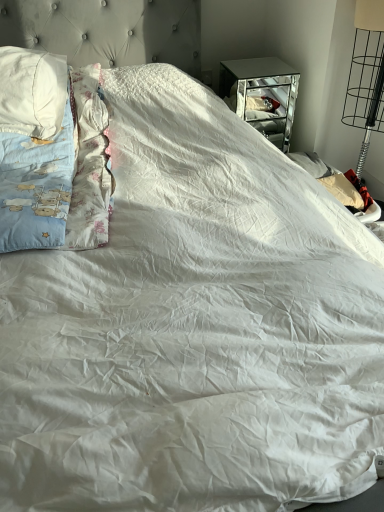
I want to click on white cotton pillow at upper left, so click(32, 92).

The image size is (384, 512). What do you see at coordinates (32, 92) in the screenshot?
I see `white cotton pillow at upper left` at bounding box center [32, 92].

Identify the location of white cotton pillow at upper left. (32, 92).